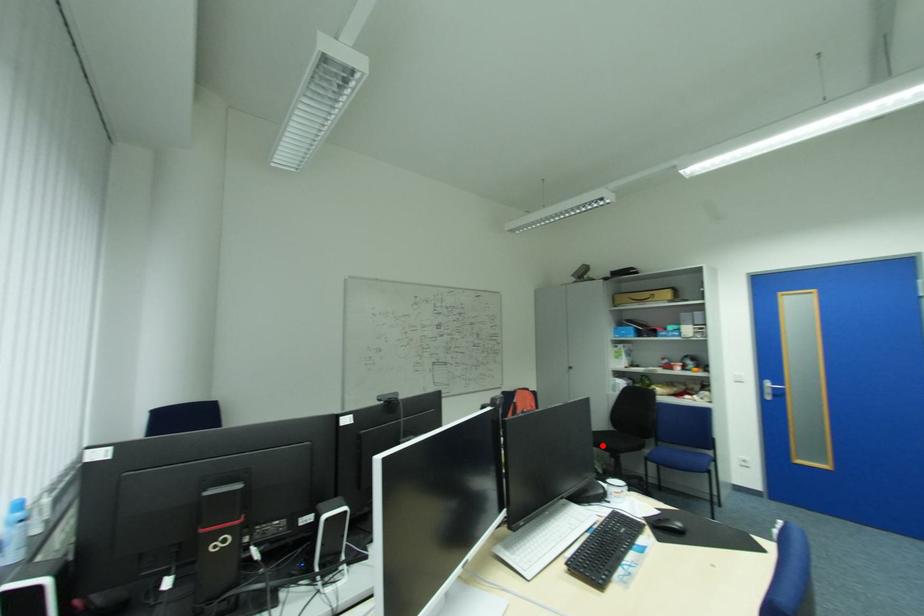
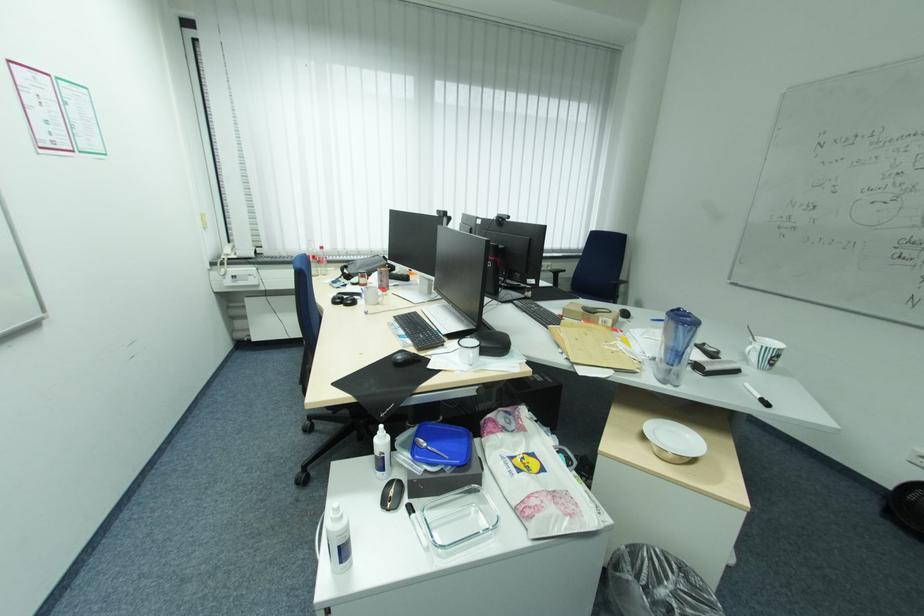
Question: I am providing you with two images of the same scene from different viewpoints. A red point is marked on the first image. Can you still see the location of the red point in image 2?

Choices:
 (A) Yes
 (B) No

Answer: (B)